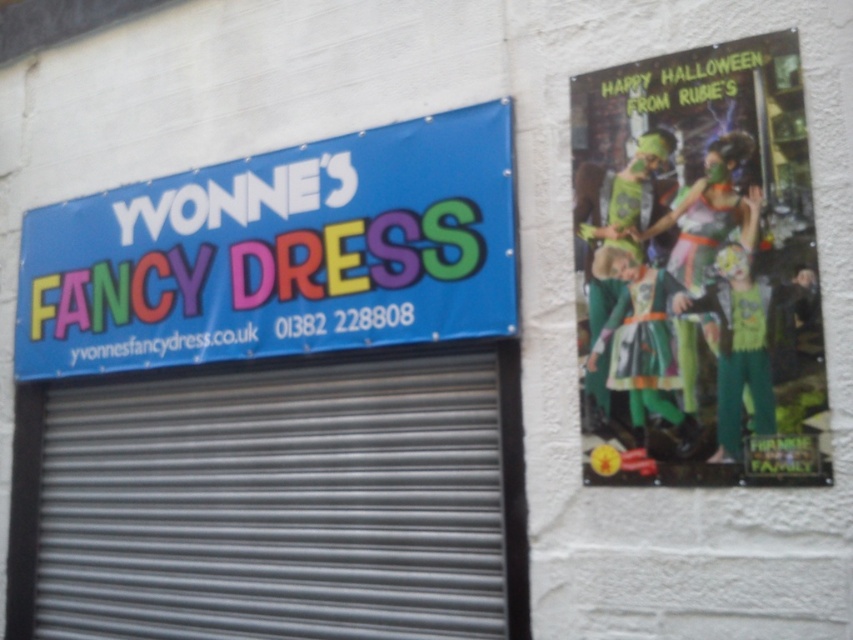
Does point (378, 442) come farther from viewer compared to point (770, 240)?

Yes, point (378, 442) is farther from viewer.

Does point (96, 577) come closer to viewer compared to point (693, 428)?

No, it is behind (693, 428).

Does point (270, 564) come in front of point (756, 323)?

No, (270, 564) is behind (756, 323).

In order to click on metallic gray garage door at center in this screenshot , I will do `click(276, 500)`.

Is metallic gray garage door at center behind blue fabric sign at upper left?

No, it is not.

Does metallic gray garage door at center appear under blue fabric sign at upper left?

Correct, metallic gray garage door at center is located below blue fabric sign at upper left.

At what (x,y) coordinates should I click in order to perform the action: click on metallic gray garage door at center. Please return your answer as a coordinate pair (x, y). Looking at the image, I should click on (276, 500).

Where is `metallic gray garage door at center`? metallic gray garage door at center is located at coordinates (276, 500).

Is the position of green fabric costume at upper right more distant than that of blue fabric sign at upper left?

No, green fabric costume at upper right is closer to the viewer.

Which of these two, green fabric costume at upper right or blue fabric sign at upper left, stands taller?

green fabric costume at upper right

Between point (683, 352) and point (88, 312), which one is positioned in front?

Point (683, 352)

You are a GUI agent. You are given a task and a screenshot of the screen. Output one action in this format:
    pyautogui.click(x=<x>, y=<y>)
    Task: Click on the green fabric costume at upper right
    
    Given the screenshot: What is the action you would take?
    pyautogui.click(x=698, y=269)